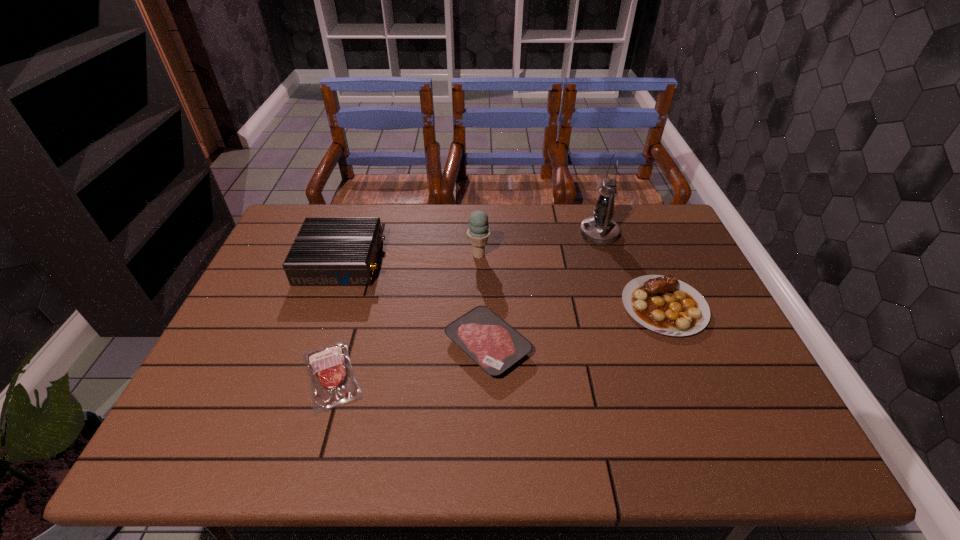
The width and height of the screenshot is (960, 540). I want to click on vacant space located on the front of the fifth shortest object, so click(x=478, y=333).

At what (x,y) coordinates should I click in order to perform the action: click on free space located on the back panel of the third tallest object. Please return your answer as a coordinate pair (x, y). The height and width of the screenshot is (540, 960). Looking at the image, I should click on (436, 261).

The image size is (960, 540). Find the location of `blank space located on the left of the tallest steak`. blank space located on the left of the tallest steak is located at coordinates (597, 306).

Identify the location of free space located on the back of the second steak from left to right. (487, 271).

Find the location of a particular element. Image resolution: width=960 pixels, height=540 pixels. vacant area situated 0.350m on the back of the shortest steak is located at coordinates (367, 254).

The height and width of the screenshot is (540, 960). In order to click on oil lamp that is positioned at the far edge in this screenshot , I will do `click(599, 229)`.

Where is `router that is at the far edge`? The image size is (960, 540). router that is at the far edge is located at coordinates (327, 251).

At what (x,y) coordinates should I click in order to perform the action: click on object present at the left edge. Please return your answer as a coordinate pair (x, y). Looking at the image, I should click on (327, 251).

At what (x,y) coordinates should I click in order to perform the action: click on object that is at the right edge. Please return your answer as a coordinate pair (x, y). The image size is (960, 540). Looking at the image, I should click on (664, 304).

Identify the location of object present at the far left corner. (327, 251).